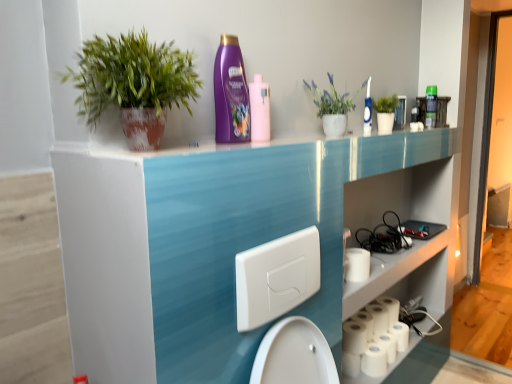
Question: Would you consider white matte toilet paper at lower right, which is counted as the 3th toilet paper, starting from the right, to be distant from blue plastic toothbrush at upper right, arranged as the 2th cleaning product when viewed from the back?

Choices:
 (A) yes
 (B) no

Answer: (B)

Question: Does white matte toilet paper at lower right, which is counted as the 3th toilet paper, starting from the right, have a greater height compared to blue plastic toothbrush at upper right, arranged as the 2th cleaning product when viewed from the back?

Choices:
 (A) no
 (B) yes

Answer: (A)

Question: Could blue plastic toothbrush at upper right, positioned as the third cleaning product in front-to-back order, be considered to be inside white matte toilet paper at lower right, which is counted as the 3th toilet paper, starting from the right?

Choices:
 (A) no
 (B) yes

Answer: (A)

Question: Is white matte toilet paper at lower right, which appears as the second toilet paper when viewed from the left, in front of blue plastic toothbrush at upper right, marked as the third cleaning product in a left-to-right arrangement?

Choices:
 (A) no
 (B) yes

Answer: (A)

Question: Is white matte toilet paper at lower right, which is counted as the 3th toilet paper, starting from the right, positioned behind blue plastic toothbrush at upper right, marked as the third cleaning product in a left-to-right arrangement?

Choices:
 (A) no
 (B) yes

Answer: (B)

Question: Is white matte toilet paper at lower right, which is counted as the 3th toilet paper, starting from the right, thinner than blue plastic toothbrush at upper right, positioned as the third cleaning product in front-to-back order?

Choices:
 (A) yes
 (B) no

Answer: (B)

Question: Does white matte paper towel at lower right come in front of white textured pot at upper center, which appears as the 2th houseplant when viewed from the left?

Choices:
 (A) yes
 (B) no

Answer: (B)

Question: Is white textured pot at upper center, which appears as the 2th houseplant when viewed from the left, at the back of white matte paper towel at lower right?

Choices:
 (A) no
 (B) yes

Answer: (A)

Question: Considering the relative sizes of white matte paper towel at lower right and white textured pot at upper center, positioned as the 2th houseplant in front-to-back order, in the image provided, is white matte paper towel at lower right shorter than white textured pot at upper center, positioned as the 2th houseplant in front-to-back order,?

Choices:
 (A) no
 (B) yes

Answer: (B)

Question: Does white matte paper towel at lower right have a larger size compared to white textured pot at upper center, which appears as the 2th houseplant when viewed from the left?

Choices:
 (A) no
 (B) yes

Answer: (A)

Question: Is white matte paper towel at lower right positioned beyond the bounds of white textured pot at upper center, arranged as the first houseplant when viewed from the right?

Choices:
 (A) no
 (B) yes

Answer: (B)

Question: Does white matte paper towel at lower right have a greater height compared to white textured pot at upper center, positioned as the 2th houseplant in front-to-back order?

Choices:
 (A) yes
 (B) no

Answer: (B)

Question: Does green matte plant at upper left, the first houseplant from the left, have a lesser height compared to white matte toilet paper at lower right, the fourth toilet paper when ordered from right to left?

Choices:
 (A) no
 (B) yes

Answer: (A)